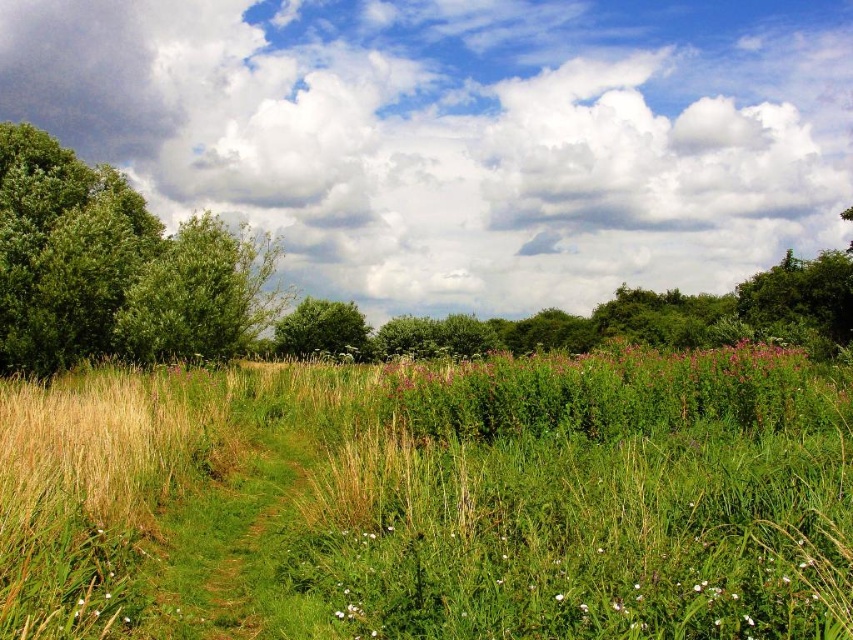
You are standing on the grassy path and want to know which tree is wider between the green leafy tree at left and the green leafy tree at center. Can you tell me which one is wider?

The green leafy tree at left is wider than the green leafy tree at center because its width surpasses the other.

You are standing at the point marked by the coordinates point (115, 268) in the image. Looking around, what type of vegetation do you see immediately around you?

The point (115, 268) corresponds to a green leafy tree at left, so you are surrounded by the green leafy tree at left.

You are standing at the center of the grassy path in the image. Looking towards the direction of the green leafy tree at left, which is marked by point [115,268], can you determine if the tree is located to your left or right side?

The green leafy tree at left is located to your left side as you face the direction it is marked by point [115,268].